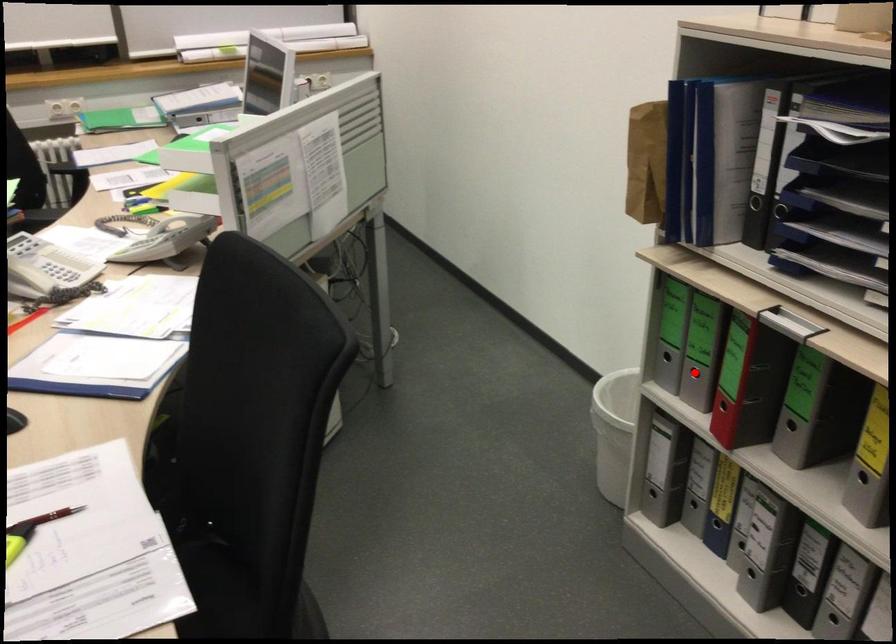
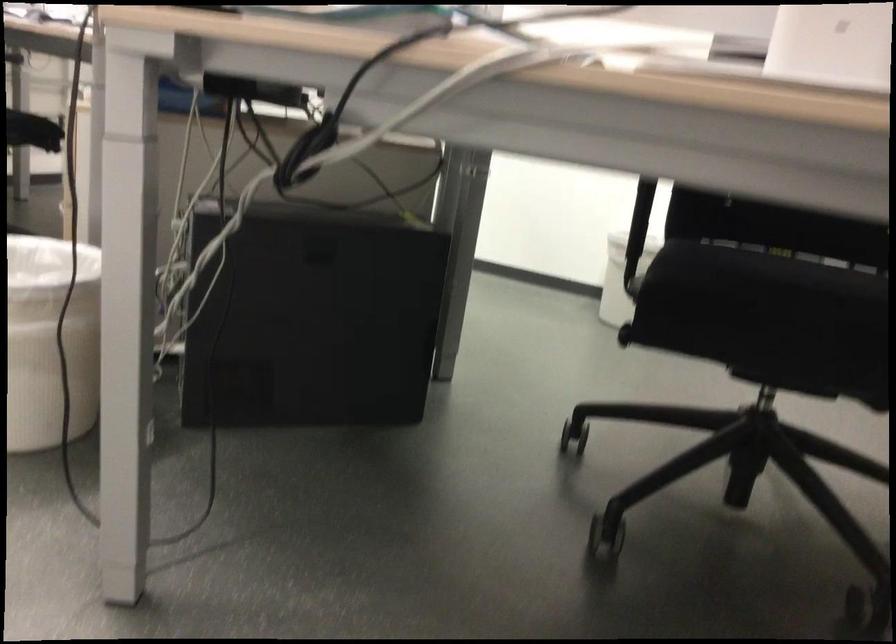
Question: I am providing you with two images of the same scene from different viewpoints. A red point is marked on the first image. At the location where the point appears in image 1, is it still visible in image 2?

Choices:
 (A) Yes
 (B) No

Answer: (B)